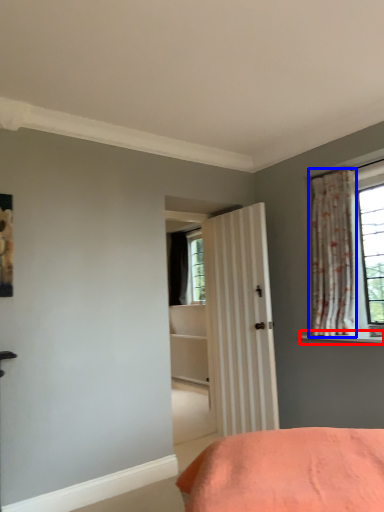
Question: Among these objects, which one is nearest to the camera, window sill (highlighted by a red box) or curtain (highlighted by a blue box)?

Choices:
 (A) window sill
 (B) curtain

Answer: (A)